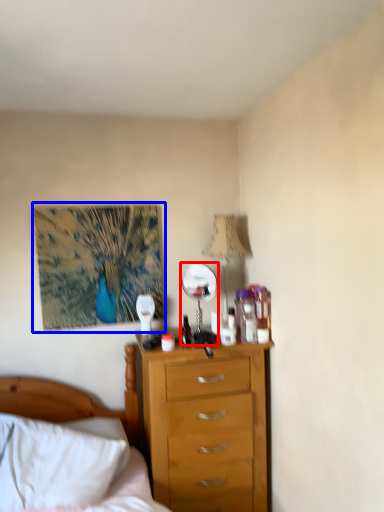
Question: Which of the following is the farthest to the observer, mirror (highlighted by a red box) or picture frame (highlighted by a blue box)?

Choices:
 (A) mirror
 (B) picture frame

Answer: (B)